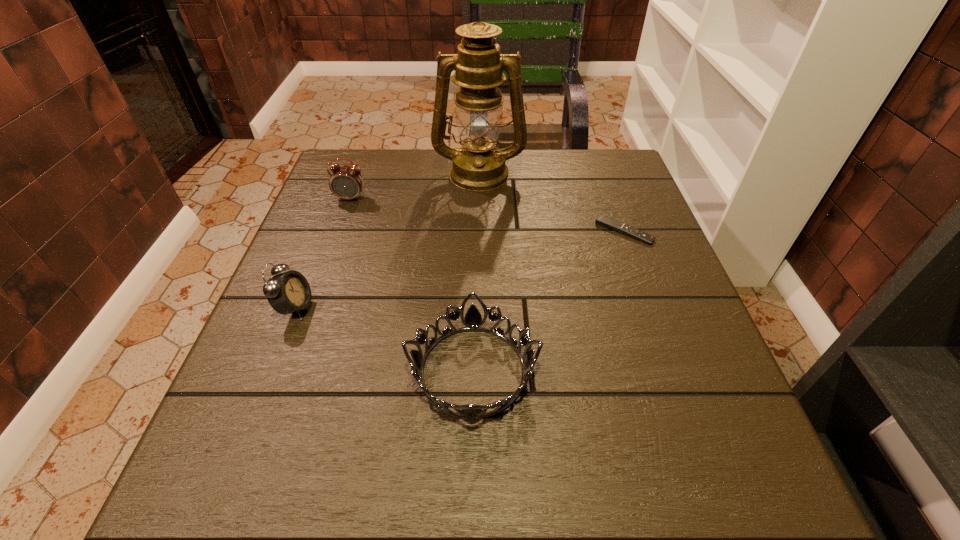
At what (x,y) coordinates should I click in order to perform the action: click on oil lamp. Please return your answer as a coordinate pair (x, y). The width and height of the screenshot is (960, 540). Looking at the image, I should click on (478, 165).

Find the location of a particular element. the farthest object is located at coordinates (478, 165).

What are the coordinates of `the farther alarm clock` in the screenshot? It's located at (346, 182).

Where is `the nearer alarm clock`? This screenshot has height=540, width=960. the nearer alarm clock is located at coordinates (288, 292).

I want to click on tiara, so click(473, 321).

Find the location of a particular element. Image resolution: width=960 pixels, height=540 pixels. the shortest object is located at coordinates (602, 220).

Where is `the rightmost object`? This screenshot has height=540, width=960. the rightmost object is located at coordinates (602, 220).

Where is `free space located on the back of the tallest object`? The width and height of the screenshot is (960, 540). free space located on the back of the tallest object is located at coordinates (479, 148).

This screenshot has width=960, height=540. I want to click on vacant space located 0.130m on the face of the fourth nearest object, so click(338, 235).

Locate an element on the screen. The height and width of the screenshot is (540, 960). free space located on the face of the nearer alarm clock is located at coordinates (372, 307).